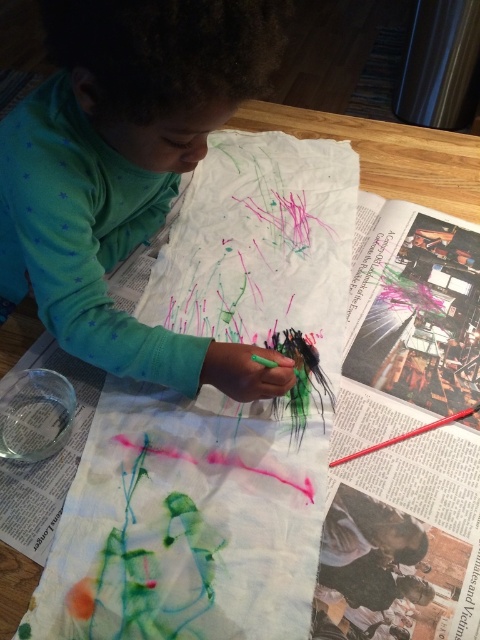
You are a photographer trying to capture the child painting. You notice two points on the table surface at coordinates point (23, 241) and point (425, 424). Which point will appear larger in your photo?

Point (23, 241) is closer to the camera than point (425, 424), so it will appear larger in the photo.